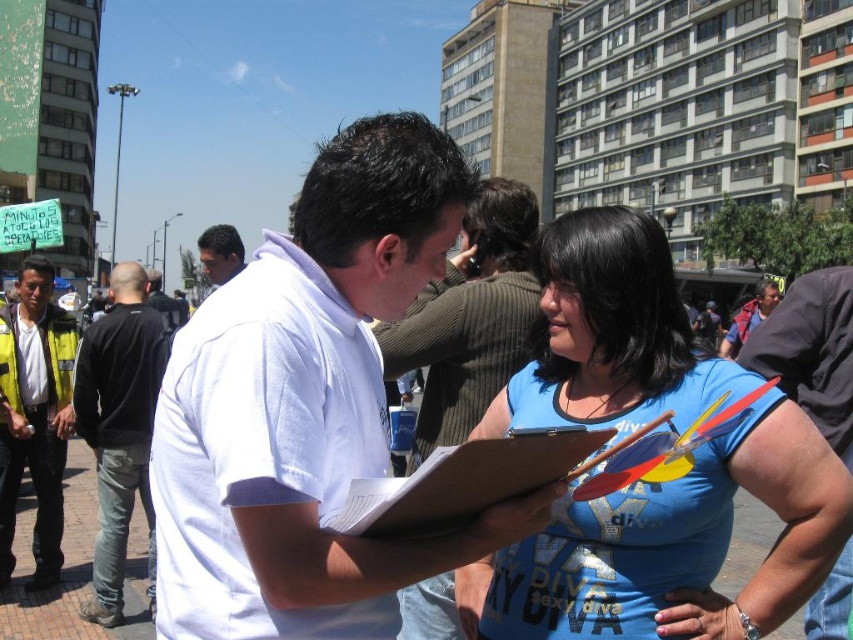
Find the location of a particular element. matte black hair at upper left is located at coordinates (219, 253).

Does matte black hair at upper left come in front of blue denim jacket at center?

Yes, matte black hair at upper left is in front of blue denim jacket at center.

This screenshot has width=853, height=640. Find the location of `matte black hair at upper left`. matte black hair at upper left is located at coordinates (219, 253).

Image resolution: width=853 pixels, height=640 pixels. In order to click on matte black hair at upper left in this screenshot , I will do `click(219, 253)`.

Which is above, white cotton shirt at center or black cotton shirt at left?

black cotton shirt at left is above.

Between point (315, 577) and point (119, 588), which one is positioned behind?

Positioned behind is point (119, 588).

At what (x,y) coordinates should I click in order to perform the action: click on white cotton shirt at center. Please return your answer as a coordinate pair (x, y). Looking at the image, I should click on (306, 406).

Who is more forward, (x=709, y=608) or (x=96, y=406)?

Point (x=709, y=608)

Who is positioned more to the left, blue cotton shirt at center or black cotton shirt at left?

From the viewer's perspective, black cotton shirt at left appears more on the left side.

Between point (625, 410) and point (105, 474), which one is positioned behind?

Point (105, 474)

The image size is (853, 640). Find the location of `blue cotton shirt at center`. blue cotton shirt at center is located at coordinates (672, 547).